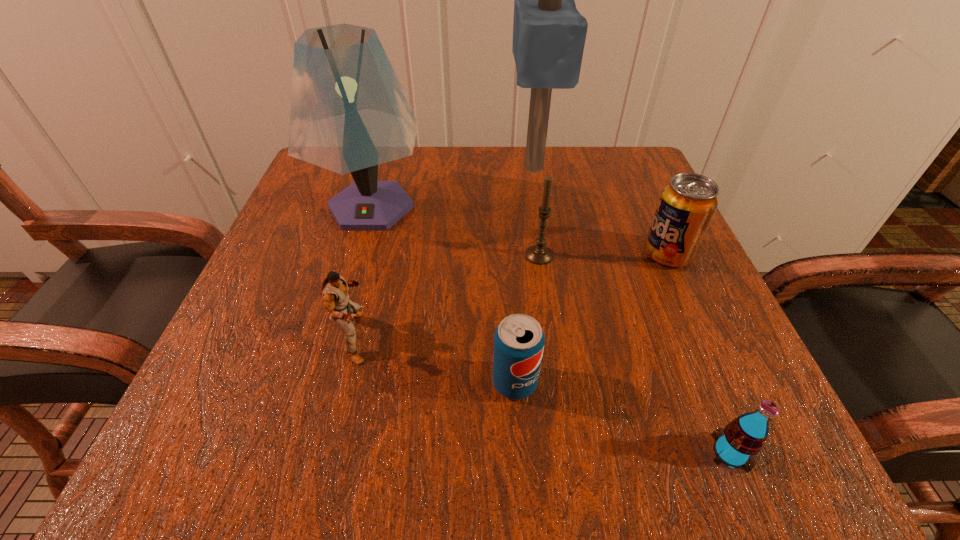
Locate an element on the screen. This screenshot has width=960, height=540. the closest soda to the puncher is located at coordinates (519, 340).

This screenshot has height=540, width=960. I want to click on free space that satisfies the following two spatial constraints: 1. on the base of the lampshade; 2. on the right side of the farthest soda, so click(x=357, y=254).

Find the location of a particular element. The image size is (960, 540). free spot that satisfies the following two spatial constraints: 1. on the base of the lampshade; 2. on the left side of the second farthest soda is located at coordinates (320, 382).

At what (x,y) coordinates should I click in order to perform the action: click on vacant space that satisfies the following two spatial constraints: 1. on the front-facing side of the puncher; 2. on the back side of the nearest object. Please return your answer as a coordinate pair (x, y). Looking at the image, I should click on (326, 453).

Find the location of a particular element. vacant space that satisfies the following two spatial constraints: 1. on the base of the lampshade; 2. on the left side of the leftmost soda is located at coordinates (320, 382).

Where is `free space in the image that satisfies the following two spatial constraints: 1. on the front-facing side of the nearest object; 2. on the left side of the puncher`? Image resolution: width=960 pixels, height=540 pixels. free space in the image that satisfies the following two spatial constraints: 1. on the front-facing side of the nearest object; 2. on the left side of the puncher is located at coordinates (326, 453).

At what (x,y) coordinates should I click in order to perform the action: click on blank space that satisfies the following two spatial constraints: 1. on the front side of the leftmost soda; 2. on the right side of the nearest soda. Please return your answer as a coordinate pair (x, y). Looking at the image, I should click on (519, 453).